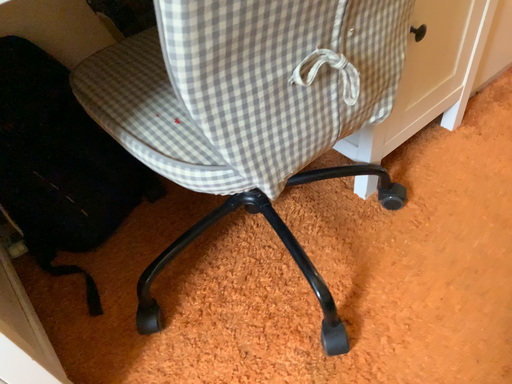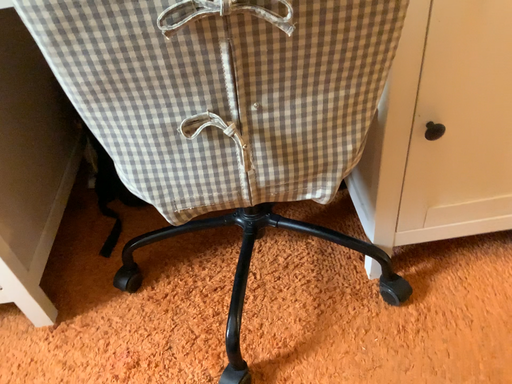
Question: Which way did the camera rotate in the video?

Choices:
 (A) rotated left
 (B) rotated right

Answer: (A)